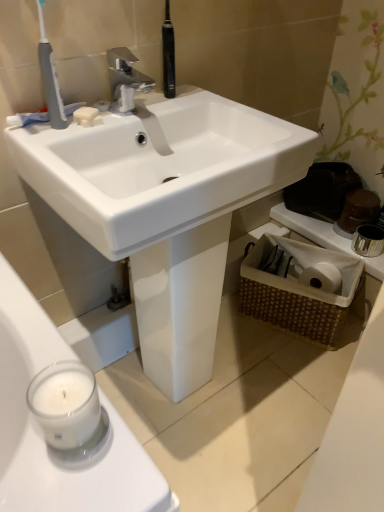
Where is `silver metallic faucet at upper center`? This screenshot has width=384, height=512. silver metallic faucet at upper center is located at coordinates (125, 80).

Find the location of a particular element. white glossy sink at center is located at coordinates (165, 206).

The height and width of the screenshot is (512, 384). Describe the element at coordinates (165, 206) in the screenshot. I see `white glossy sink at center` at that location.

Find the location of a particular element. white matte toothpaste at upper left is located at coordinates (27, 118).

Is white matte counter top at right next to white glossy sink at center and touching it?

No.

Which object is further away from the camera taking this photo, white matte counter top at right or white glossy sink at center?

white matte counter top at right is further from the camera.

Is point (277, 220) farther from camera compared to point (155, 251)?

Yes.

From the picture: Is white glossy sink at center at the back of white matte counter top at right?

No, white glossy sink at center is not at the back of white matte counter top at right.

From the image's perspective, is white matte soap at upper left positioned above or below white glossy sink at center?

white matte soap at upper left is situated higher than white glossy sink at center in the image.

Can you tell me how much white matte soap at upper left and white glossy sink at center differ in facing direction?

There is a 31.1-degree angle between the facing directions of white matte soap at upper left and white glossy sink at center.

Can you confirm if white matte soap at upper left is positioned to the left of white glossy sink at center?

Correct, you'll find white matte soap at upper left to the left of white glossy sink at center.

Could you tell me if woven brown basket at lower right is turned towards white glossy sink at center?

Yes, woven brown basket at lower right is facing white glossy sink at center.

Is woven brown basket at lower right closer to camera compared to white glossy sink at center?

No, the depth of woven brown basket at lower right is greater than that of white glossy sink at center.

Between woven brown basket at lower right and white glossy sink at center, which one has smaller width?

Thinner between the two is woven brown basket at lower right.

Is point (93, 114) less distant than point (41, 54)?

No.

Considering the positions of objects white matte soap at upper left and gray plastic toothbrush at upper left in the image provided, who is more to the left, white matte soap at upper left or gray plastic toothbrush at upper left?

From the viewer's perspective, gray plastic toothbrush at upper left appears more on the left side.

Between white matte soap at upper left and gray plastic toothbrush at upper left, which one has larger size?

Bigger between the two is gray plastic toothbrush at upper left.

Which is behind, white matte soap at upper left or gray plastic toothbrush at upper left?

white matte soap at upper left.

Considering the sizes of white glossy sink at center and woven brown basket at lower right in the image, is white glossy sink at center wider or thinner than woven brown basket at lower right?

white glossy sink at center is wider than woven brown basket at lower right.

Is white glossy sink at center spatially inside woven brown basket at lower right, or outside of it?

white glossy sink at center is spatially situated outside woven brown basket at lower right.

Considering the relative positions of white glossy sink at center and woven brown basket at lower right in the image provided, is white glossy sink at center to the left of woven brown basket at lower right from the viewer's perspective?

Yes, white glossy sink at center is to the left of woven brown basket at lower right.

Is gray plastic toothbrush at upper left facing away from white matte soap at upper left?

No, gray plastic toothbrush at upper left's orientation is not away from white matte soap at upper left.

Which of these two, gray plastic toothbrush at upper left or white matte soap at upper left, stands shorter?

white matte soap at upper left.

Consider the image. Which of these two, gray plastic toothbrush at upper left or white matte soap at upper left, is smaller?

white matte soap at upper left.

Where is `soap on the right of gray plastic toothbrush at upper left`? This screenshot has width=384, height=512. soap on the right of gray plastic toothbrush at upper left is located at coordinates (85, 113).

Is white matte toothpaste at upper left not within woven brown basket at lower right?

white matte toothpaste at upper left lies outside woven brown basket at lower right's area.

From the image's perspective, is white matte toothpaste at upper left beneath woven brown basket at lower right?

No, from the image's perspective, white matte toothpaste at upper left is not beneath woven brown basket at lower right.

Locate an element on the screen. The width and height of the screenshot is (384, 512). basket directly beneath the white matte toothpaste at upper left (from a real-world perspective) is located at coordinates (299, 287).

Is white matte toothpaste at upper left thinner than woven brown basket at lower right?

Yes, white matte toothpaste at upper left is thinner than woven brown basket at lower right.

Locate an element on the screen. The image size is (384, 512). sink on the left of the white matte counter top at right is located at coordinates (165, 206).

There is a white glossy sink at center. Where is `soap above it (from a real-world perspective)`? soap above it (from a real-world perspective) is located at coordinates (85, 113).

Looking at the image, which one is located further to silver metallic faucet at upper center, white matte counter top at right or white matte toothpaste at upper left?

white matte counter top at right is further to silver metallic faucet at upper center.

Which object lies further to the anchor point woven brown basket at lower right, white matte toothpaste at upper left or white matte soap at upper left?

Among the two, white matte toothpaste at upper left is located further to woven brown basket at lower right.

Estimate the real-world distances between objects in this image. Which object is closer to white matte counter top at right, white glossy sink at center or woven brown basket at lower right?

woven brown basket at lower right is positioned closer to the anchor white matte counter top at right.

Considering their positions, is white matte soap at upper left positioned further to white matte counter top at right than white matte toothpaste at upper left?

Among the two, white matte toothpaste at upper left is located further to white matte counter top at right.

Looking at the image, which one is located further to white matte toothpaste at upper left, gray plastic toothbrush at upper left or white matte soap at upper left?

gray plastic toothbrush at upper left is further to white matte toothpaste at upper left.

When comparing their distances from white matte toothpaste at upper left, does gray plastic toothbrush at upper left or woven brown basket at lower right seem further?

The object further to white matte toothpaste at upper left is woven brown basket at lower right.

Looking at the image, which one is located closer to white matte toothpaste at upper left, white matte counter top at right or silver metallic faucet at upper center?

silver metallic faucet at upper center lies closer to white matte toothpaste at upper left than the other object.

When comparing their distances from woven brown basket at lower right, does gray plastic toothbrush at upper left or white glossy sink at center seem closer?

white glossy sink at center.

Find the location of a particular element. This screenshot has width=384, height=512. soap that lies between gray plastic toothbrush at upper left and white glossy sink at center from top to bottom is located at coordinates (85, 113).

This screenshot has width=384, height=512. I want to click on soap between white matte toothpaste at upper left and silver metallic faucet at upper center from left to right, so click(x=85, y=113).

Find the location of a particular element. This screenshot has height=512, width=384. soap between white matte toothpaste at upper left and woven brown basket at lower right from left to right is located at coordinates (85, 113).

Identify the location of sink between white matte soap at upper left and white matte counter top at right in the horizontal direction. (165, 206).